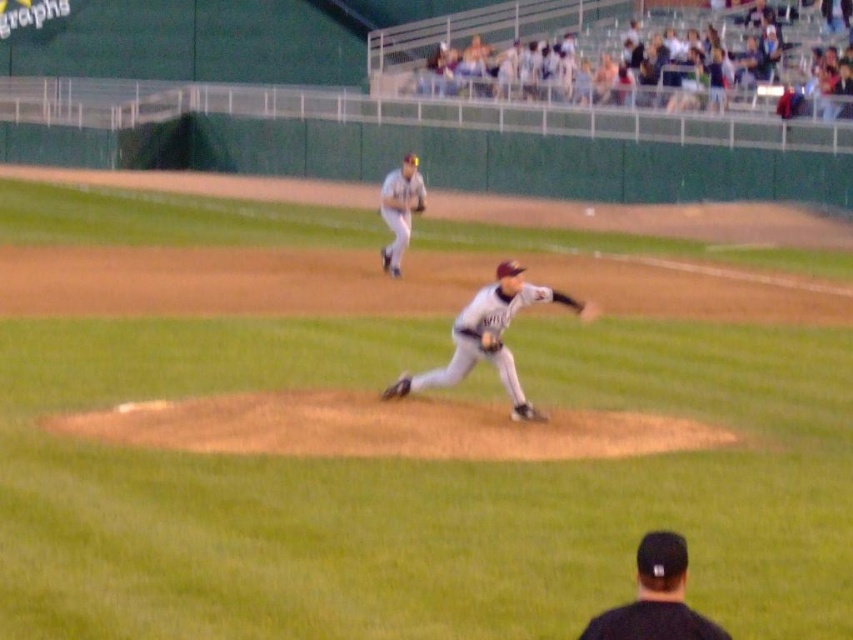
Who is higher up, white uniform at upper center or dark gray leather glove at center?

white uniform at upper center

Measure the distance between point [392,186] and camera.

Point [392,186] and camera are 78.04 feet apart from each other.

Locate an element on the screen. Image resolution: width=853 pixels, height=640 pixels. white uniform at upper center is located at coordinates (399, 209).

Where is `white uniform at upper center`? white uniform at upper center is located at coordinates (399, 209).

Does gray matte uniform at center appear on the left side of dark gray leather glove at center?

In fact, gray matte uniform at center is to the right of dark gray leather glove at center.

I want to click on gray matte uniform at center, so click(x=492, y=330).

Locate an element on the screen. Image resolution: width=853 pixels, height=640 pixels. gray matte uniform at center is located at coordinates (492, 330).

The width and height of the screenshot is (853, 640). I want to click on black fabric cap at lower center, so click(654, 598).

Can you confirm if black fabric cap at lower center is bigger than dark gray leather glove at center?

Yes, black fabric cap at lower center is bigger than dark gray leather glove at center.

Locate an element on the screen. The image size is (853, 640). black fabric cap at lower center is located at coordinates (654, 598).

The image size is (853, 640). Find the location of `black fabric cap at lower center`. black fabric cap at lower center is located at coordinates (654, 598).